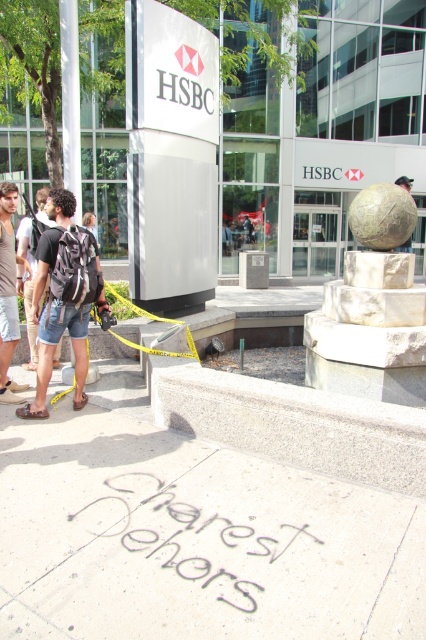
Which is more to the left, black chalk writing at center or dark blue denim shorts at left?

dark blue denim shorts at left

Does black chalk writing at center appear over dark blue denim shorts at left?

Incorrect, black chalk writing at center is not positioned above dark blue denim shorts at left.

Which is in front, point (296, 538) or point (31, 321)?

Positioned in front is point (296, 538).

Identify the location of black chalk writing at center. coord(198,532).

Does black concrete sidewalk at lower center have a greater width compared to black chalk writing at center?

Indeed, black concrete sidewalk at lower center has a greater width compared to black chalk writing at center.

The height and width of the screenshot is (640, 426). What do you see at coordinates (190, 534) in the screenshot? I see `black concrete sidewalk at lower center` at bounding box center [190, 534].

Between point (227, 628) and point (123, 557), which one is positioned behind?

Positioned behind is point (123, 557).

Identify the location of black concrete sidewalk at lower center. (190, 534).

Does black concrete sidewalk at lower center have a lesser height compared to camouflage backpack at center?

Correct, black concrete sidewalk at lower center is not as tall as camouflage backpack at center.

Is point (117, 636) positioned before point (94, 252)?

Yes, it is in front of point (94, 252).

Identify the location of black concrete sidewalk at lower center. This screenshot has width=426, height=640. (190, 534).